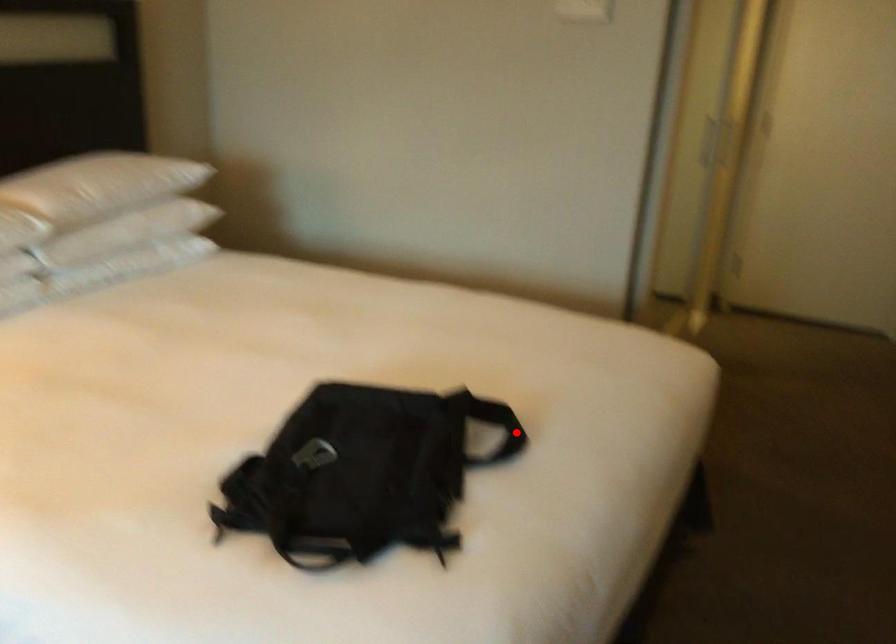
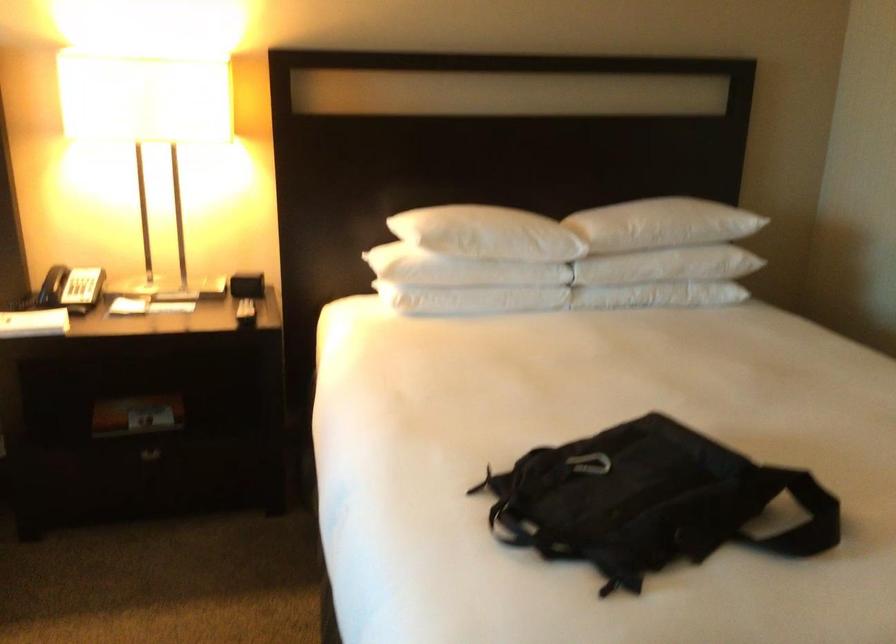
Question: A red point is marked in image1. In image2, is the corresponding 3D point closer to the camera or farther? Reply with the corresponding letter.

Choices:
 (A) The corresponding 3D point is closer.
 (B) The corresponding 3D point is farther.

Answer: (A)